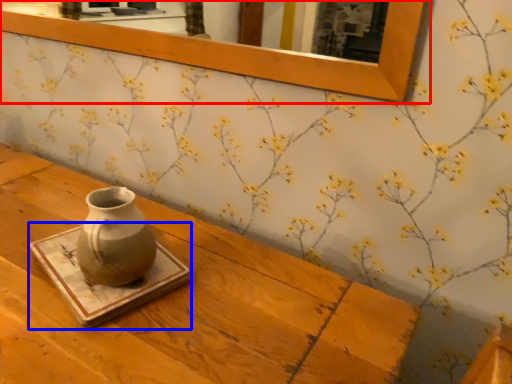
Question: Which of the following is the closest to the observer, picture frame (highlighted by a red box) or tray (highlighted by a blue box)?

Choices:
 (A) picture frame
 (B) tray

Answer: (B)